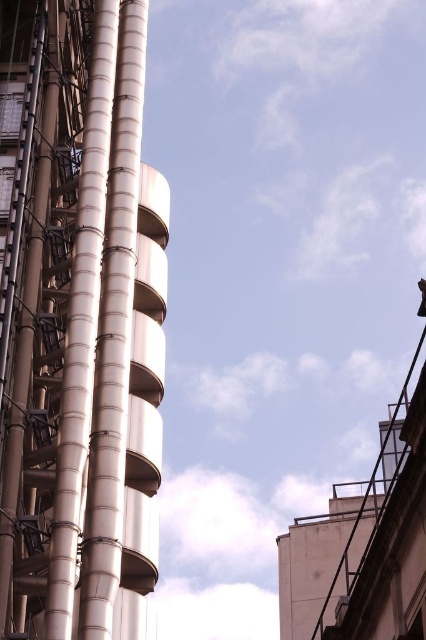
Is point (109, 72) closer to viewer compared to point (124, 188)?

No.

Identify the location of polished silver tower at left. The image size is (426, 640). (77, 321).

Where is `polished silver tower at left`? This screenshot has width=426, height=640. polished silver tower at left is located at coordinates (77, 321).

At what (x,y) coordinates should I click in order to perform the action: click on polished silver tower at left. Please return your answer as a coordinate pair (x, y). Image resolution: width=426 pixels, height=640 pixels. Looking at the image, I should click on (77, 321).

Find the location of a particular element. The width and height of the screenshot is (426, 640). sleek metallic spiral at center is located at coordinates (115, 339).

Between sleek metallic spiral at center and metallic silver pipes at center, which one is positioned higher?

sleek metallic spiral at center is above.

What are the coordinates of `sleek metallic spiral at center` in the screenshot? It's located at (115, 339).

Find the location of `polished silver tower at left`. polished silver tower at left is located at coordinates (77, 321).

Describe the element at coordinates (77, 321) in the screenshot. I see `polished silver tower at left` at that location.

What are the coordinates of `polished silver tower at left` in the screenshot? It's located at (77, 321).